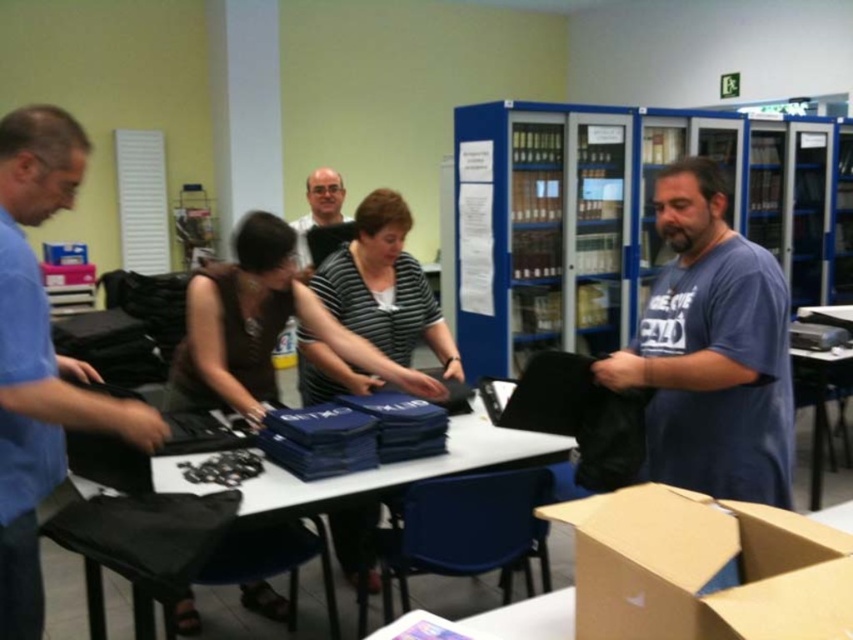
Where is `cardboard box at lower right`? Image resolution: width=853 pixels, height=640 pixels. cardboard box at lower right is located at coordinates (703, 568).

Looking at this image, does cardboard box at lower right have a lesser height compared to matte black laptop at left?

Correct, cardboard box at lower right is not as tall as matte black laptop at left.

Which is in front, point (788, 528) or point (22, 374)?

Point (788, 528) is more forward.

The image size is (853, 640). I want to click on cardboard box at lower right, so click(703, 568).

Consider the image. Who is higher up, matte black laptop at left or matte black laptop at upper center?

Positioned higher is matte black laptop at upper center.

Does matte black laptop at left have a smaller size compared to matte black laptop at upper center?

No.

Who is more distant from viewer, (15, 556) or (331, 205)?

The point (331, 205) is more distant.

At what (x,y) coordinates should I click in order to perform the action: click on matte black laptop at left. Please return your answer as a coordinate pair (x, y). The width and height of the screenshot is (853, 640). Looking at the image, I should click on (39, 356).

Between cardboard box at lower right and matte black shirt at center, which one appears on the left side from the viewer's perspective?

matte black shirt at center

Is cardboard box at lower right smaller than matte black shirt at center?

Correct, cardboard box at lower right occupies less space than matte black shirt at center.

Is point (659, 548) farther from camera compared to point (204, 336)?

No, (659, 548) is in front of (204, 336).

Where is `cardboard box at lower right`? cardboard box at lower right is located at coordinates (703, 568).